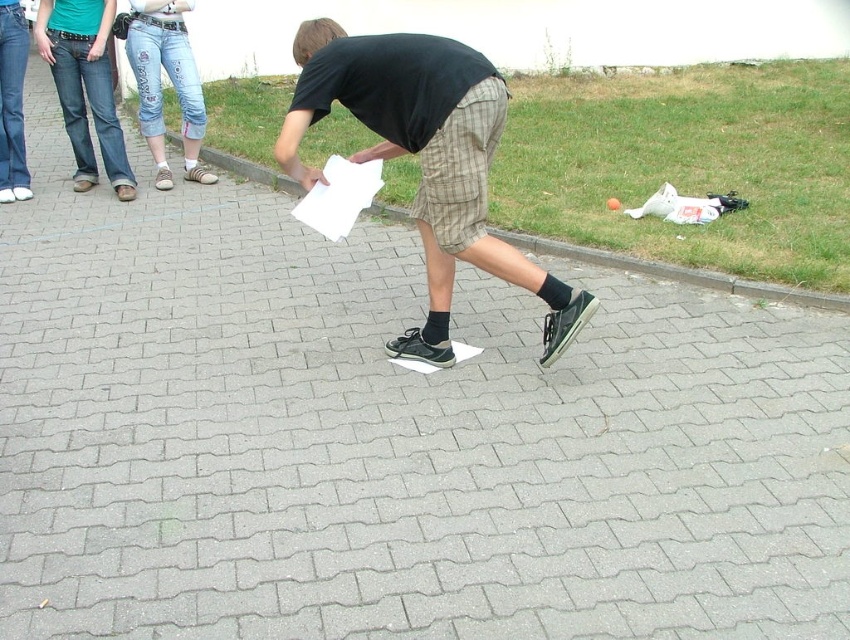
The height and width of the screenshot is (640, 850). What do you see at coordinates (426, 161) in the screenshot? I see `black matte shirt at center` at bounding box center [426, 161].

Measure the distance between point [406,102] and camera.

Point [406,102] is 3.15 meters away from camera.

Who is more forward, (484, 180) or (591, 259)?

Positioned in front is point (484, 180).

The image size is (850, 640). Identify the location of black matte shirt at center. (426, 161).

Between denim jeans at upper left and gray concrete curb at center, which one is positioned higher?

denim jeans at upper left is above.

Can you confirm if denim jeans at upper left is taller than gray concrete curb at center?

Indeed, denim jeans at upper left has a greater height compared to gray concrete curb at center.

Is point (193, 150) positioned in front of point (586, 250)?

No, (193, 150) is further to viewer.

Find the location of a particular element. The width and height of the screenshot is (850, 640). denim jeans at upper left is located at coordinates (170, 81).

Who is taller, black matte shirt at center or denim jeans at upper left?

black matte shirt at center

Is black matte shirt at center to the right of denim jeans at upper left from the viewer's perspective?

Yes, black matte shirt at center is to the right of denim jeans at upper left.

Which is in front, point (536, 284) or point (150, 16)?

Point (536, 284) is in front.

What are the coordinates of `black matte shirt at center` in the screenshot? It's located at click(426, 161).